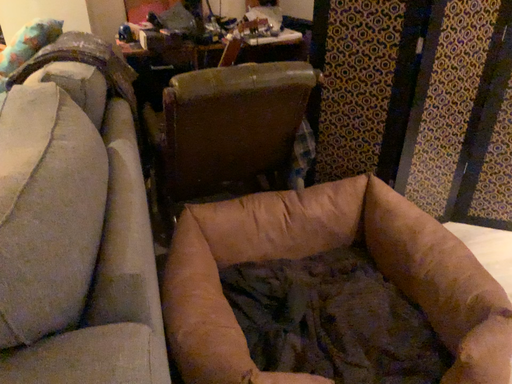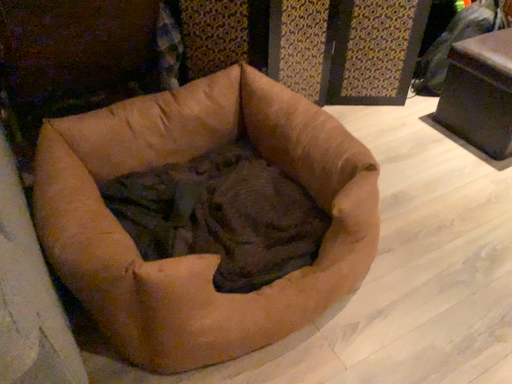
Question: How did the camera likely rotate when shooting the video?

Choices:
 (A) rotated left
 (B) rotated right

Answer: (B)